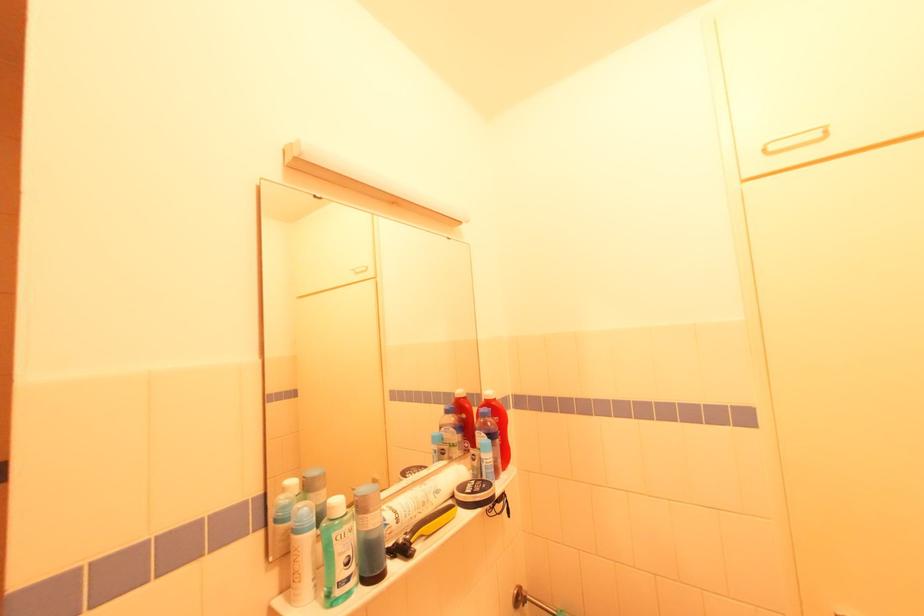
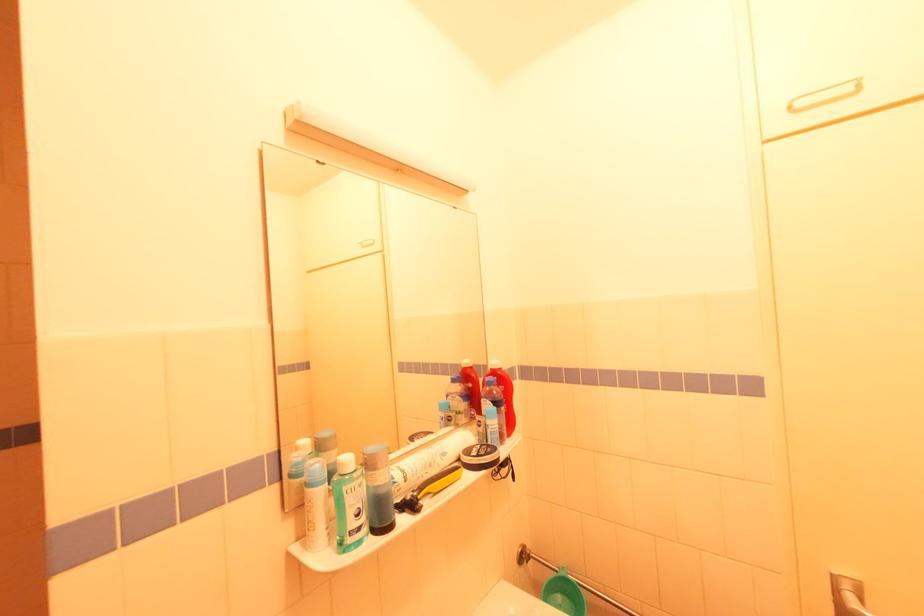
Question: The images are taken continuously from a first-person perspective. In which direction is your viewpoint rotating?

Choices:
 (A) Left
 (B) Right
 (C) Up
 (D) Down

Answer: (D)